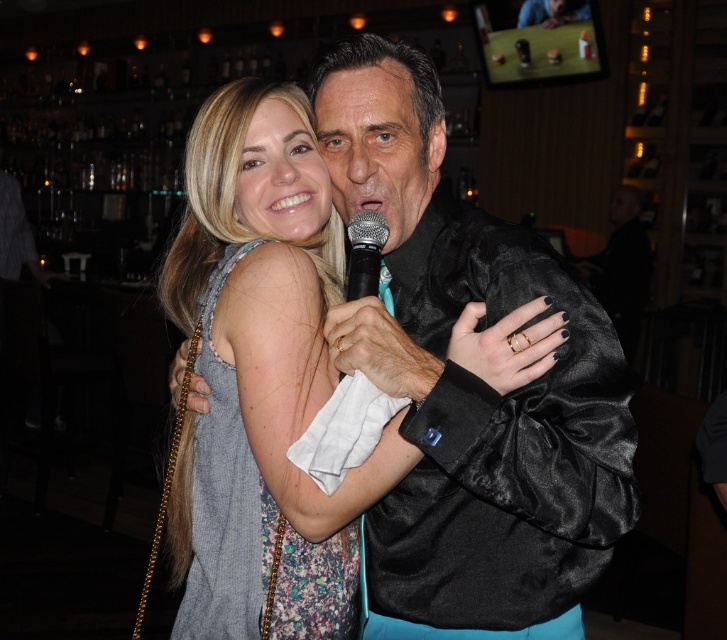
Does satin black jacket at center have a lesser width compared to silver metallic microphone at center?

Incorrect, satin black jacket at center's width is not less than silver metallic microphone at center's.

Does satin black jacket at center appear over silver metallic microphone at center?

No.

Image resolution: width=727 pixels, height=640 pixels. Describe the element at coordinates (467, 381) in the screenshot. I see `satin black jacket at center` at that location.

Where is `satin black jacket at center`? This screenshot has height=640, width=727. satin black jacket at center is located at coordinates (467, 381).

Is floral fabric dress at center thinner than silver metallic microphone at center?

In fact, floral fabric dress at center might be wider than silver metallic microphone at center.

Which is behind, point (289, 586) or point (349, 248)?

The point (349, 248) is behind.

This screenshot has height=640, width=727. What do you see at coordinates (225, 499) in the screenshot? I see `floral fabric dress at center` at bounding box center [225, 499].

Where is `floral fabric dress at center`? The width and height of the screenshot is (727, 640). floral fabric dress at center is located at coordinates (225, 499).

I want to click on satin black jacket at center, so click(x=467, y=381).

Measure the distance between satin black jacket at center and camera.

satin black jacket at center and camera are 37.80 inches apart from each other.

Find the location of `satin black jacket at center`. satin black jacket at center is located at coordinates (467, 381).